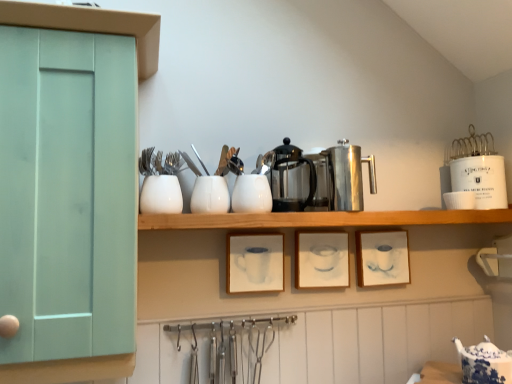
Question: Considering the relative positions of blue and white porcelain teapot at lower right, which is the 1th tableware in bottom-to-top order, and white glossy cup at upper right, the sixth tableware viewed from the top, in the image provided, is blue and white porcelain teapot at lower right, which is the 1th tableware in bottom-to-top order, to the right of white glossy cup at upper right, the sixth tableware viewed from the top, from the viewer's perspective?

Choices:
 (A) yes
 (B) no

Answer: (A)

Question: From a real-world perspective, is blue and white porcelain teapot at lower right, acting as the seventh tableware starting from the left, below white glossy cup at upper right, placed as the sixth tableware when sorted from left to right?

Choices:
 (A) yes
 (B) no

Answer: (A)

Question: Is blue and white porcelain teapot at lower right, which is the 1th tableware in bottom-to-top order, oriented towards white glossy cup at upper right, the 2th tableware viewed from the right?

Choices:
 (A) yes
 (B) no

Answer: (B)

Question: Can you confirm if blue and white porcelain teapot at lower right, which appears as the first tableware when viewed from the right, is smaller than white glossy cup at upper right, the 2th tableware viewed from the right?

Choices:
 (A) no
 (B) yes

Answer: (A)

Question: Is blue and white porcelain teapot at lower right, which ranks as the 7th tableware in top-to-bottom order, placed right next to white glossy cup at upper right, placed as the sixth tableware when sorted from left to right?

Choices:
 (A) yes
 (B) no

Answer: (B)

Question: From a real-world perspective, relative to polished stainless steel coffee pot at center, placed as the 1th appliance when sorted from left to right, is mint green wood cabinet at left vertically above or below?

Choices:
 (A) above
 (B) below

Answer: (B)

Question: Based on their sizes in the image, would you say mint green wood cabinet at left is bigger or smaller than polished stainless steel coffee pot at center, placed as the 1th appliance when sorted from left to right?

Choices:
 (A) small
 (B) big

Answer: (B)

Question: Is point (71, 367) positioned closer to the camera than point (294, 188)?

Choices:
 (A) closer
 (B) farther

Answer: (A)

Question: Do you think mint green wood cabinet at left is within polished stainless steel coffee pot at center, the fourth appliance from the right, or outside of it?

Choices:
 (A) inside
 (B) outside

Answer: (B)

Question: Which is correct: polished stainless steel coffee press at center, which appears as the 3th appliance when viewed from the left, is inside mint green wood cabinet at left, or outside of it?

Choices:
 (A) inside
 (B) outside

Answer: (B)

Question: Considering their positions, is polished stainless steel coffee press at center, the second appliance positioned from the right, located in front of or behind mint green wood cabinet at left?

Choices:
 (A) front
 (B) behind

Answer: (B)

Question: Is polished stainless steel coffee press at center, which appears as the 3th appliance when viewed from the left, taller or shorter than mint green wood cabinet at left?

Choices:
 (A) tall
 (B) short

Answer: (B)

Question: From a real-world perspective, is polished stainless steel coffee press at center, the second appliance positioned from the right, above or below mint green wood cabinet at left?

Choices:
 (A) above
 (B) below

Answer: (A)

Question: Is white glossy fork at upper center, which is the sixth tableware in right-to-left order, bigger or smaller than white glossy vase at upper center, the fourth tableware ordered from the bottom?

Choices:
 (A) big
 (B) small

Answer: (B)

Question: From a real-world perspective, is white glossy fork at upper center, which is the sixth tableware in right-to-left order, above or below white glossy vase at upper center, which is counted as the 1th tableware, starting from the left?

Choices:
 (A) below
 (B) above

Answer: (B)